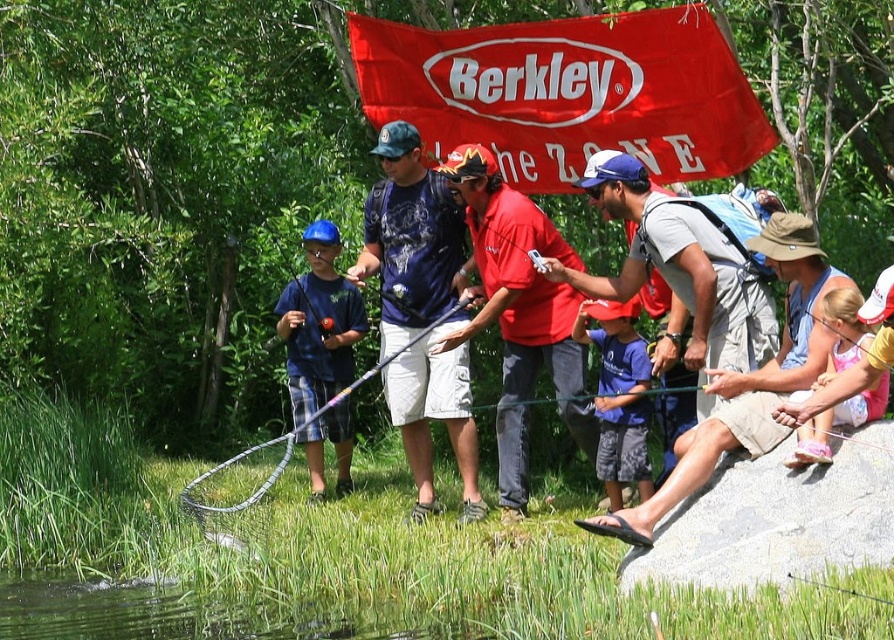
You are standing at the edge of the water and want to find the point labeled as point (200,612). According to the scene description, where would you look?

The point (200,612) is located on the green grass at lower center.

Consider the image. You are standing at the location of the camera. You want to pick up the pink fabric dress at lower right. Is it within your reach without moving your feet?

The pink fabric dress at lower right and camera are 6.53 meters apart. Since the distance is more than an average person can reach without moving, you cannot pick it up without moving your feet.